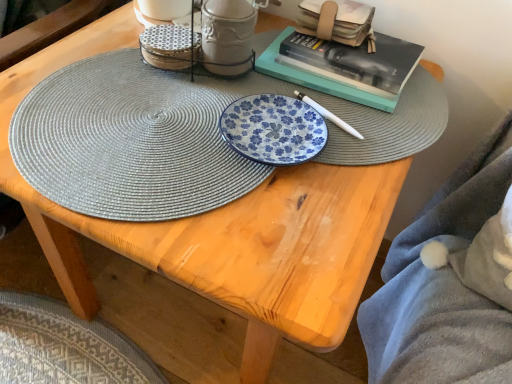
What do you see at coordinates (337, 21) in the screenshot? I see `hardcover book at upper right` at bounding box center [337, 21].

Measure the distance between soft gray plush blanket at lower right and camera.

21.82 inches.

This screenshot has height=384, width=512. Describe the element at coordinates (227, 36) in the screenshot. I see `matte ceramic mug at upper center, which is the second tableware in left-to-right order` at that location.

Where is `matte gray woven placemat at center`? Image resolution: width=512 pixels, height=384 pixels. matte gray woven placemat at center is located at coordinates (132, 140).

Is porcelain textured coasters at upper center, arranged as the first tableware when viewed from the left, to the left of soft gray plush blanket at lower right from the viewer's perspective?

Yes.

Is porcelain textured coasters at upper center, marked as the 2th tableware in a right-to-left arrangement, inside the boundaries of soft gray plush blanket at lower right, or outside?

porcelain textured coasters at upper center, marked as the 2th tableware in a right-to-left arrangement, cannot be found inside soft gray plush blanket at lower right.

Looking at the image, does porcelain textured coasters at upper center, marked as the 2th tableware in a right-to-left arrangement, seem bigger or smaller compared to soft gray plush blanket at lower right?

Clearly, porcelain textured coasters at upper center, marked as the 2th tableware in a right-to-left arrangement, is smaller in size than soft gray plush blanket at lower right.

Does point (45, 173) appear closer or farther from the camera than point (203, 8)?

Point (45, 173) is closer to the camera than point (203, 8).

Which object is wider, matte gray woven placemat at center or matte ceramic mug at upper center, which is the second tableware in left-to-right order?

Wider between the two is matte gray woven placemat at center.

Who is shorter, matte gray woven placemat at center or matte ceramic mug at upper center, which ranks as the first tableware in right-to-left order?

With less height is matte gray woven placemat at center.

From a real-world perspective, is matte gray woven placemat at center positioned over matte ceramic mug at upper center, which is the second tableware in left-to-right order, based on gravity?

Actually, matte gray woven placemat at center is physically below matte ceramic mug at upper center, which is the second tableware in left-to-right order, in the real world.

Where is `book located on the right of porcelain textured coasters at upper center, arranged as the first tableware when viewed from the left`? This screenshot has height=384, width=512. book located on the right of porcelain textured coasters at upper center, arranged as the first tableware when viewed from the left is located at coordinates (337, 21).

Between porcelain textured coasters at upper center, marked as the 2th tableware in a right-to-left arrangement, and hardcover book at upper right, which one has less height?

porcelain textured coasters at upper center, marked as the 2th tableware in a right-to-left arrangement.

Looking at the image, does porcelain textured coasters at upper center, arranged as the first tableware when viewed from the left, seem bigger or smaller compared to hardcover book at upper right?

Clearly, porcelain textured coasters at upper center, arranged as the first tableware when viewed from the left, is smaller in size than hardcover book at upper right.

In terms of width, does porcelain textured coasters at upper center, marked as the 2th tableware in a right-to-left arrangement, look wider or thinner when compared to hardcover book at upper right?

Clearly, porcelain textured coasters at upper center, marked as the 2th tableware in a right-to-left arrangement, has less width compared to hardcover book at upper right.

Considering the sizes of matte ceramic mug at upper center, which is the second tableware in left-to-right order, and soft gray plush blanket at lower right in the image, is matte ceramic mug at upper center, which is the second tableware in left-to-right order, wider or thinner than soft gray plush blanket at lower right?

In the image, matte ceramic mug at upper center, which is the second tableware in left-to-right order, appears to be more narrow than soft gray plush blanket at lower right.

Looking at this image, from a real-world perspective, is matte ceramic mug at upper center, which ranks as the first tableware in right-to-left order, beneath soft gray plush blanket at lower right?

Incorrect, from a real-world perspective, matte ceramic mug at upper center, which ranks as the first tableware in right-to-left order, is higher than soft gray plush blanket at lower right.

From the picture: Is matte ceramic mug at upper center, which ranks as the first tableware in right-to-left order, to the left or to the right of soft gray plush blanket at lower right in the image?

In the image, matte ceramic mug at upper center, which ranks as the first tableware in right-to-left order, appears on the left side of soft gray plush blanket at lower right.

Based on their sizes in the image, would you say matte ceramic mug at upper center, which is the second tableware in left-to-right order, is bigger or smaller than soft gray plush blanket at lower right?

In the image, matte ceramic mug at upper center, which is the second tableware in left-to-right order, appears to be smaller than soft gray plush blanket at lower right.

In the scene shown: From the image's perspective, is hardcover book at upper right on soft gray plush blanket at lower right?

Correct, hardcover book at upper right appears higher than soft gray plush blanket at lower right in the image.

Is hardcover book at upper right taller or shorter than soft gray plush blanket at lower right?

Considering their sizes, hardcover book at upper right has less height than soft gray plush blanket at lower right.

Find the location of a particular element. blanket on the right of the hardcover book at upper right is located at coordinates (443, 286).

Measure the distance between hardcover book at upper right and soft gray plush blanket at lower right.

A distance of 15.76 inches exists between hardcover book at upper right and soft gray plush blanket at lower right.

Can you confirm if matte ceramic mug at upper center, which is the second tableware in left-to-right order, is smaller than matte gray woven placemat at center?

Correct, matte ceramic mug at upper center, which is the second tableware in left-to-right order, occupies less space than matte gray woven placemat at center.

From the image's perspective, between matte ceramic mug at upper center, which is the second tableware in left-to-right order, and matte gray woven placemat at center, who is located below?

matte gray woven placemat at center is shown below in the image.

Can you tell me how much matte ceramic mug at upper center, which is the second tableware in left-to-right order, and matte gray woven placemat at center differ in facing direction?

0.467 degrees separate the facing orientations of matte ceramic mug at upper center, which is the second tableware in left-to-right order, and matte gray woven placemat at center.

Which point is more distant from viewer, (x=205, y=4) or (x=87, y=60)?

The point (x=205, y=4) is farther from the camera.

How far apart are porcelain textured coasters at upper center, marked as the 2th tableware in a right-to-left arrangement, and matte ceramic mug at upper center, which is the second tableware in left-to-right order?

They are 2.22 inches apart.

Does point (156, 35) lie behind point (227, 67)?

Yes, point (156, 35) is behind point (227, 67).

Does porcelain textured coasters at upper center, marked as the 2th tableware in a right-to-left arrangement, have a lesser width compared to matte ceramic mug at upper center, which is the second tableware in left-to-right order?

No, porcelain textured coasters at upper center, marked as the 2th tableware in a right-to-left arrangement, is not thinner than matte ceramic mug at upper center, which is the second tableware in left-to-right order.

How different are the orientations of porcelain textured coasters at upper center, marked as the 2th tableware in a right-to-left arrangement, and matte ceramic mug at upper center, which is the second tableware in left-to-right order, in degrees?

0.512 degrees.

In order to click on the 1st tableware above the soft gray plush blanket at lower right (from the image's perspective) in this screenshot , I will do `click(170, 46)`.

From a real-world perspective, starting from the matte gray woven placemat at center, which tableware is the 2nd one vertically above it? Please provide its 2D coordinates.

[(227, 36)]

Consider the image. Estimate the real-world distances between objects in this image. Which object is further from hardcover book at upper right, matte ceramic mug at upper center, which ranks as the first tableware in right-to-left order, or matte gray woven placemat at center?

The object further to hardcover book at upper right is matte gray woven placemat at center.

From the image, which object appears to be nearer to hardcover book at upper right, matte ceramic mug at upper center, which ranks as the first tableware in right-to-left order, or porcelain textured coasters at upper center, arranged as the first tableware when viewed from the left?

Based on the image, matte ceramic mug at upper center, which ranks as the first tableware in right-to-left order, appears to be nearer to hardcover book at upper right.

Based on their spatial positions, is matte gray woven placemat at center or porcelain textured coasters at upper center, marked as the 2th tableware in a right-to-left arrangement, closer to hardcover book at upper right?

→ Based on the image, porcelain textured coasters at upper center, marked as the 2th tableware in a right-to-left arrangement, appears to be nearer to hardcover book at upper right.

Looking at the image, which one is located further to soft gray plush blanket at lower right, matte ceramic mug at upper center, which is the second tableware in left-to-right order, or hardcover book at upper right?

Based on the image, matte ceramic mug at upper center, which is the second tableware in left-to-right order, appears to be further to soft gray plush blanket at lower right.

Estimate the real-world distances between objects in this image. Which object is closer to soft gray plush blanket at lower right, matte gray woven placemat at center or matte ceramic mug at upper center, which ranks as the first tableware in right-to-left order?

The object closer to soft gray plush blanket at lower right is matte gray woven placemat at center.

When comparing their distances from matte ceramic mug at upper center, which is the second tableware in left-to-right order, does soft gray plush blanket at lower right or matte gray woven placemat at center seem closer?

matte gray woven placemat at center lies closer to matte ceramic mug at upper center, which is the second tableware in left-to-right order, than the other object.

Estimate the real-world distances between objects in this image. Which object is closer to soft gray plush blanket at lower right, matte ceramic mug at upper center, which ranks as the first tableware in right-to-left order, or matte gray woven placemat at center?

matte gray woven placemat at center lies closer to soft gray plush blanket at lower right than the other object.

When comparing their distances from matte ceramic mug at upper center, which is the second tableware in left-to-right order, does matte gray woven placemat at center or porcelain textured coasters at upper center, arranged as the first tableware when viewed from the left, seem further?

matte gray woven placemat at center.

You are a GUI agent. You are given a task and a screenshot of the screen. Output one action in this format:
    pyautogui.click(x=<x>, y=<y>)
    Task: Click on the tableware between matte gray woven placemat at center and porcelain textured coasters at upper center, marked as the 2th tableware in a right-to-left arrangement, in the front-back direction
    This screenshot has height=384, width=512.
    Given the screenshot: What is the action you would take?
    pyautogui.click(x=227, y=36)

You are a GUI agent. You are given a task and a screenshot of the screen. Output one action in this format:
    pyautogui.click(x=<x>, y=<y>)
    Task: Click on the book between matte gray woven placemat at center and soft gray plush blanket at lower right in the horizontal direction
    Image resolution: width=512 pixels, height=384 pixels.
    Given the screenshot: What is the action you would take?
    pyautogui.click(x=337, y=21)

Find the location of a particular element. This screenshot has height=384, width=512. book situated between porcelain textured coasters at upper center, marked as the 2th tableware in a right-to-left arrangement, and soft gray plush blanket at lower right from left to right is located at coordinates (337, 21).

Find the location of a particular element. tableware between porcelain textured coasters at upper center, marked as the 2th tableware in a right-to-left arrangement, and hardcover book at upper right from left to right is located at coordinates (227, 36).